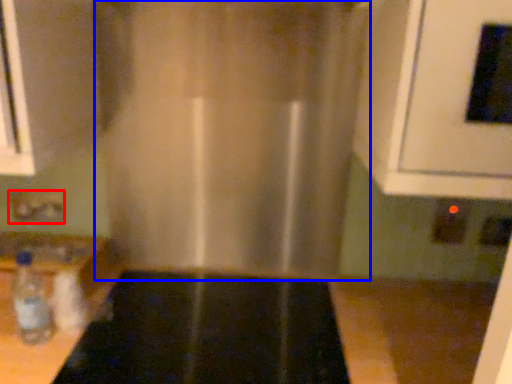
Question: Which of the following is the closest to the observer, electric outlet (highlighted by a red box) or curtain (highlighted by a blue box)?

Choices:
 (A) electric outlet
 (B) curtain

Answer: (B)